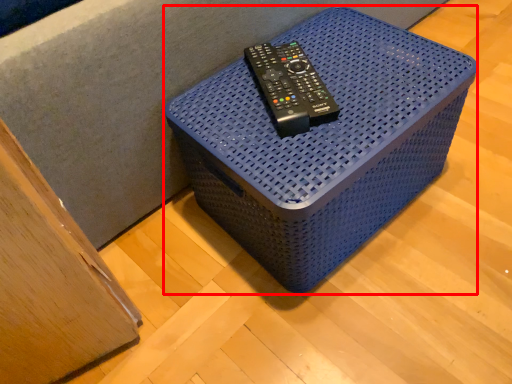
Question: From the image's perspective, where is furniture (annotated by the red box) located in relation to equipment in the image?

Choices:
 (A) below
 (B) above

Answer: (A)